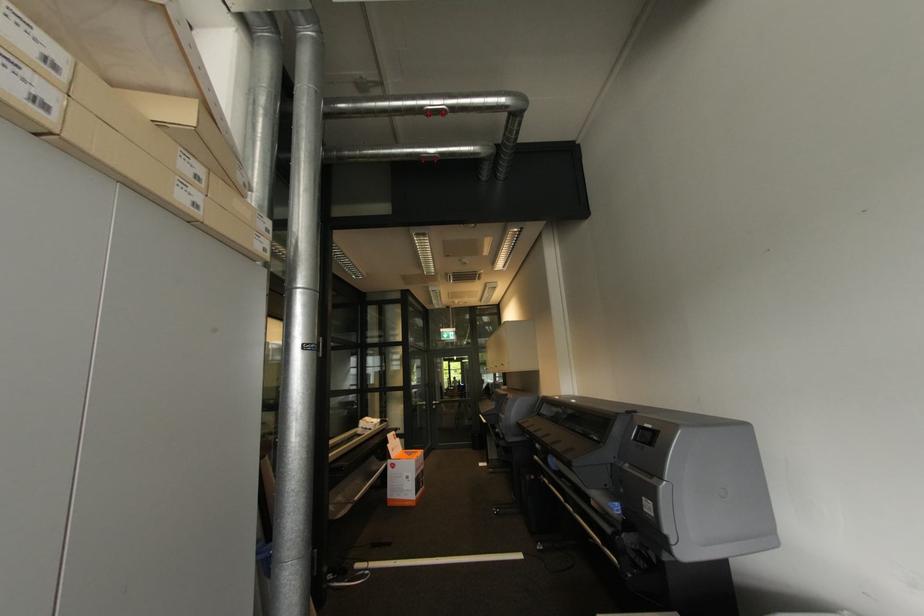
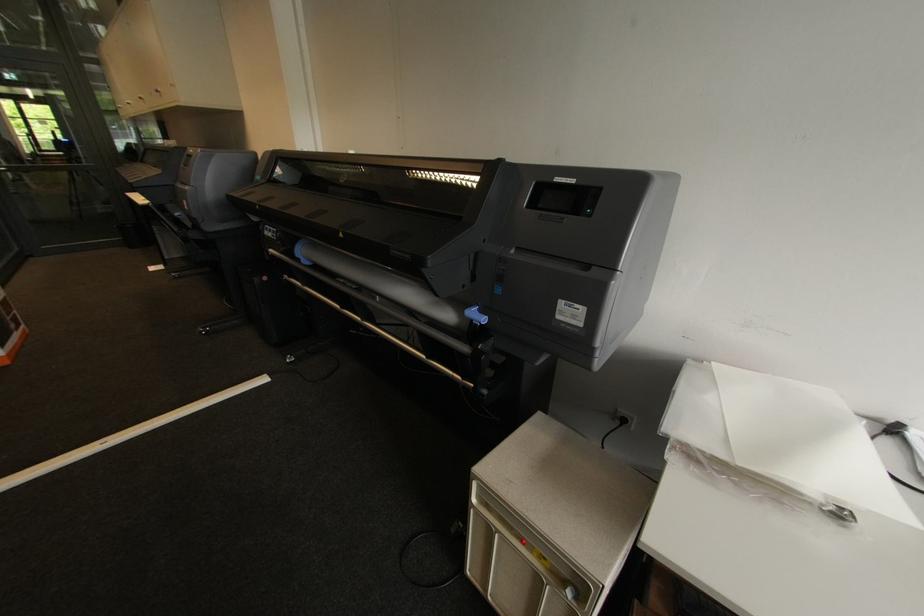
Find the pixel in the second image that matches point 524,557 in the first image.

(268, 379)